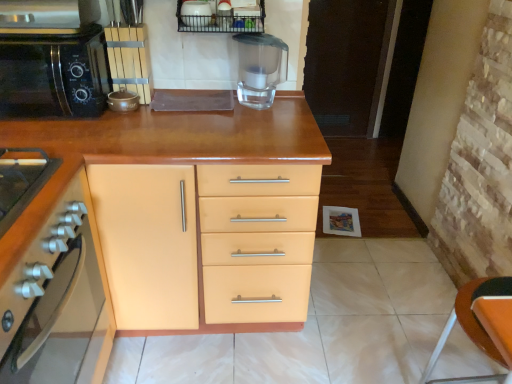
Where is `vacant region in front of matte brown pot at upper left, arranged as the 2th appliance when viewed from the right`? This screenshot has height=384, width=512. vacant region in front of matte brown pot at upper left, arranged as the 2th appliance when viewed from the right is located at coordinates [x=126, y=130].